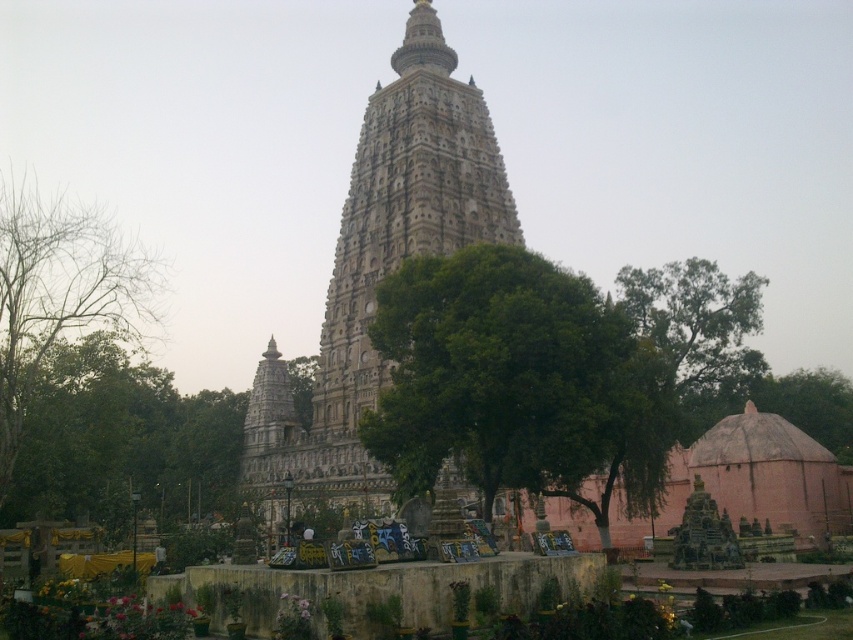
Question: Among these objects, which one is farthest from the camera?

Choices:
 (A) green leafy tree at left
 (B) brown textured dome at lower right
 (C) bare branches at left

Answer: (A)

Question: Which of these objects is positioned closest to the green leafy tree at left?

Choices:
 (A) stone carved tower at center
 (B) bare branches at left
 (C) green leafy tree at center

Answer: (B)

Question: Where is green leafy tree at center located in relation to bare branches at left in the image?

Choices:
 (A) left
 (B) right

Answer: (B)

Question: Which of the following is the farthest from the observer?

Choices:
 (A) green leafy tree at center
 (B) green leafy tree at left

Answer: (B)

Question: Does green leafy tree at center have a lesser width compared to brown textured dome at lower right?

Choices:
 (A) yes
 (B) no

Answer: (A)

Question: Does green leafy tree at left appear on the right side of brown textured dome at lower right?

Choices:
 (A) no
 (B) yes

Answer: (A)